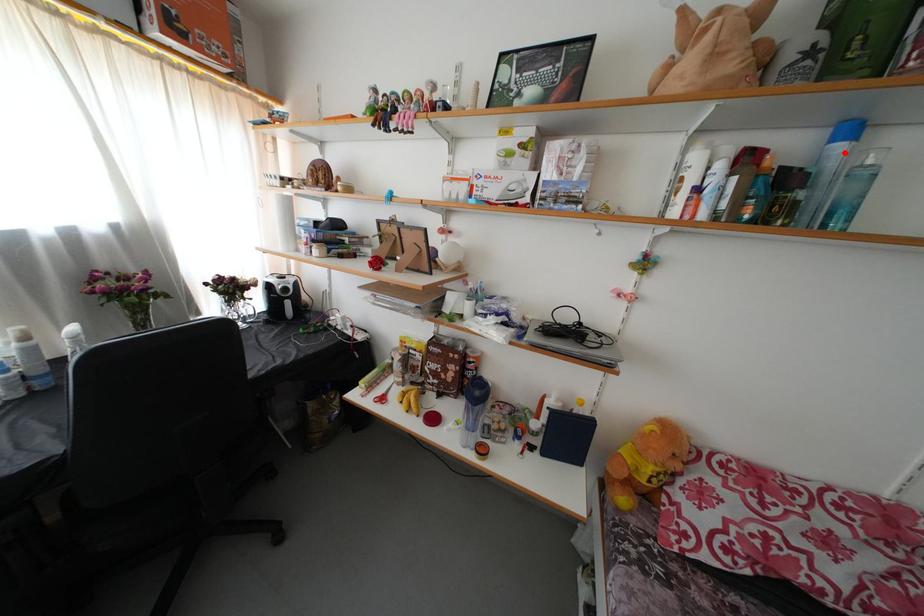
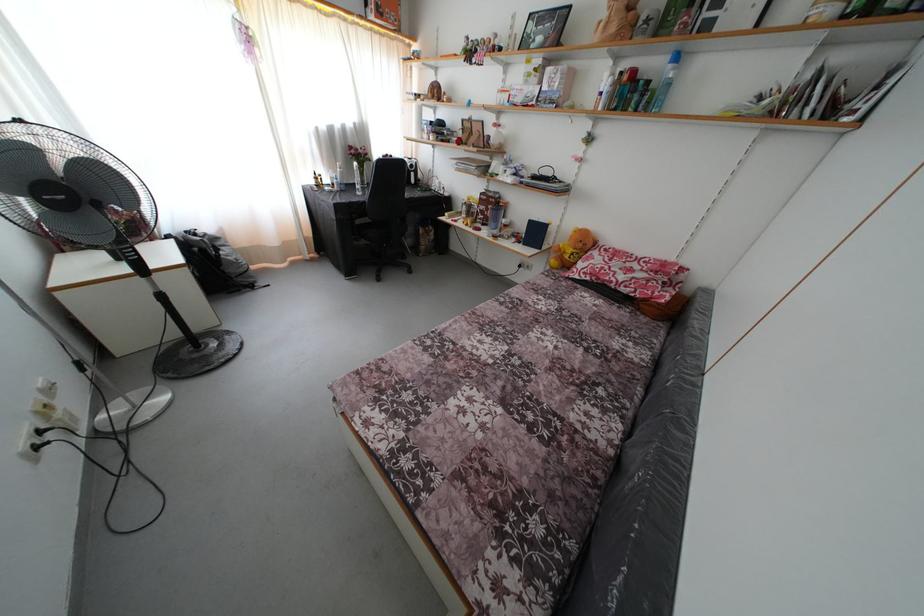
In the second image, find the point that corresponds to the highlighted location in the first image.

(675, 73)